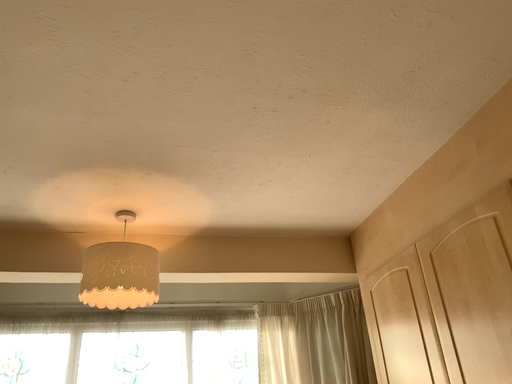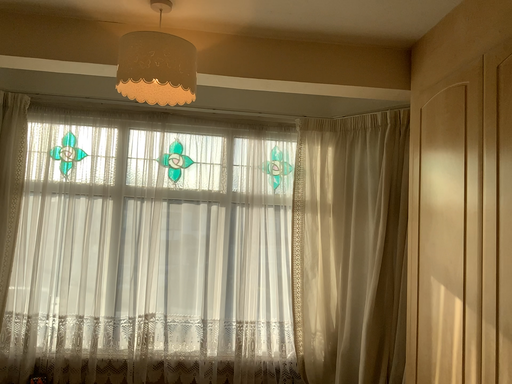
Question: How did the camera likely rotate when shooting the video?

Choices:
 (A) rotated right
 (B) rotated left

Answer: (B)